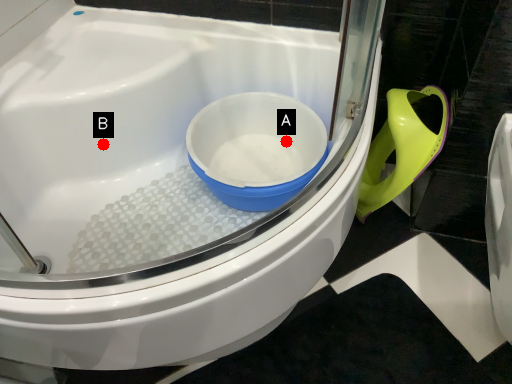
Question: Two points are circled on the image, labeled by A and B beside each circle. Which point is further to the camera?

Choices:
 (A) A is further
 (B) B is further

Answer: (A)